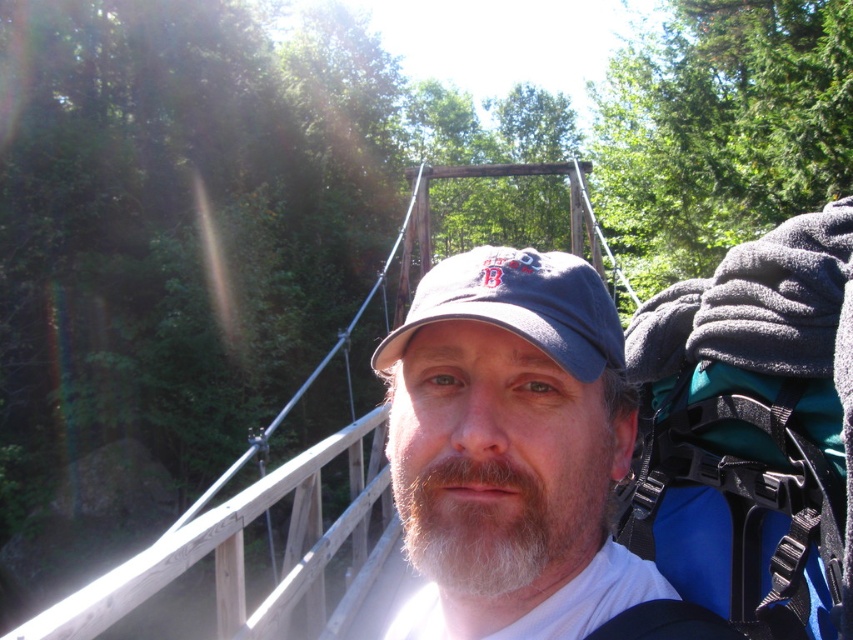
Question: Which object is closer to the camera taking this photo?

Choices:
 (A) blue fabric cap at center
 (B) gray fabric cap at center
 (C) white fuzzy beard at center
 (D) teal fabric backpack at upper right

Answer: (C)

Question: Which of the following is the farthest from the observer?

Choices:
 (A) (399, 326)
 (B) (489, 554)
 (C) (773, 515)
 (D) (397, 493)

Answer: (A)

Question: Is gray fabric cap at center smaller than white fuzzy beard at center?

Choices:
 (A) yes
 (B) no

Answer: (B)

Question: Is gray fabric cap at center below blue fabric cap at center?

Choices:
 (A) yes
 (B) no

Answer: (A)

Question: Can you confirm if gray fabric cap at center is positioned below white fuzzy beard at center?

Choices:
 (A) no
 (B) yes

Answer: (B)

Question: Which point is farther to the camera?

Choices:
 (A) blue fabric cap at center
 (B) white fuzzy beard at center
 (C) gray fabric cap at center

Answer: (A)